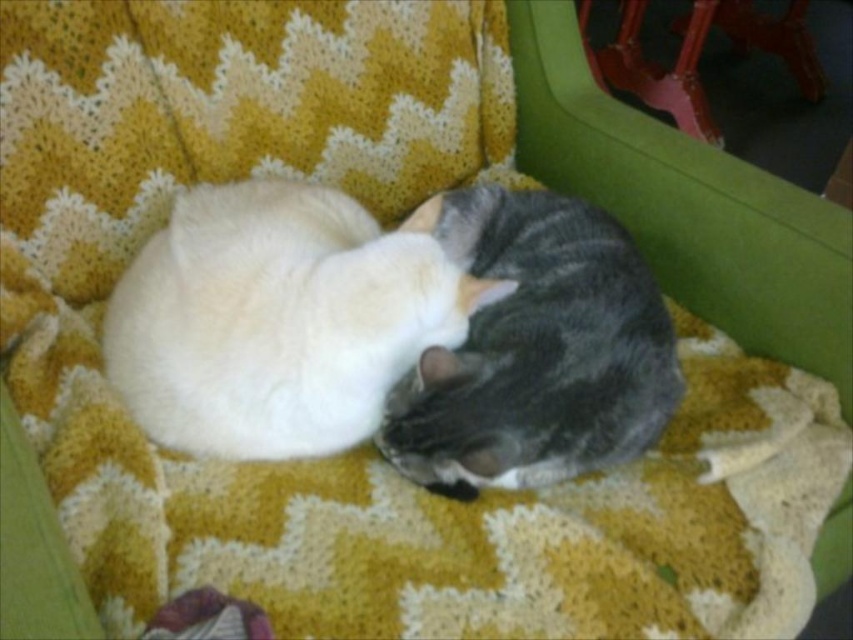
Based on the photo, you are a photographer trying to capture both the white soft fur cat at center and the gray striped cat at center in a single shot. Since your camera can only focus on one cat at a time, which cat should you adjust the focus to first if you want to ensure the cat closer to the left side is in focus?

You should focus on the white soft fur cat at center first because it is positioned to the left of the gray striped cat at center, making it closer to the left side of the frame.

Based on the photo, you are a photographer standing 36 inches away from a red sofa in the background. You want to take a photo of the white soft fur cat at center. Can you move closer to the cat without moving the sofa? Explain why or why not based on the distance provided.

The white soft fur cat at center is 36.95 inches away from the viewer. Since you are currently 36 inches away from the red sofa in the background, you can move closer to the cat as long as you don not move the sofa, because the cat is slightly farther away than your current position relative to the sofa. However, ensure that moving closer doesn not interfere with the sofa

You are standing in front of the armchair with the cats. You notice two points marked on the image. Which point is closer to you, point (167, 429) or point (526, 332)?

Point (167, 429) is closer to the viewer than point (526, 332).